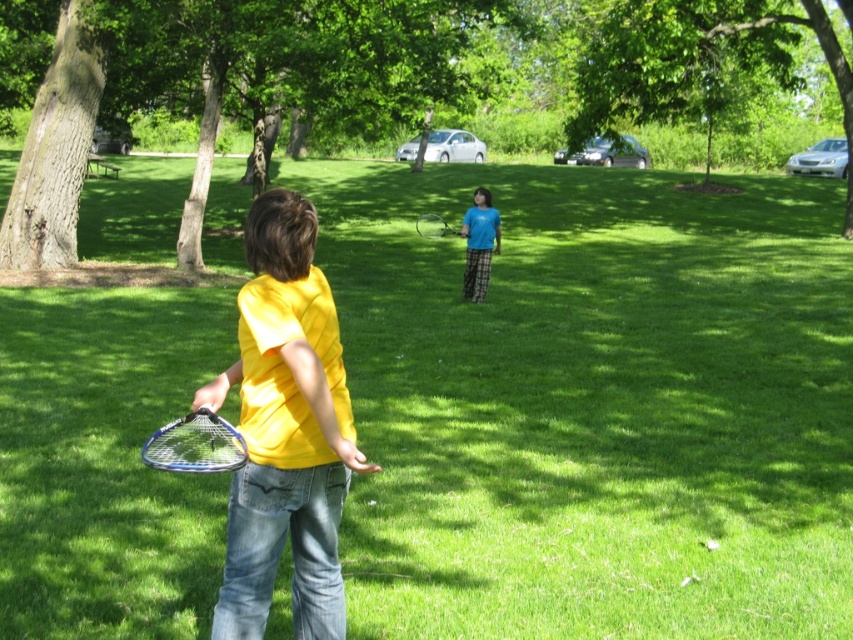
Question: Which of the following is the closest to the observer?

Choices:
 (A) (639, 65)
 (B) (149, 100)
 (C) (270, 273)

Answer: (C)

Question: Which point is farther from the camera taking this photo?

Choices:
 (A) (32, 170)
 (B) (490, 204)
 (C) (573, 113)

Answer: (C)

Question: Which object appears closest to the camera in this image?

Choices:
 (A) yellow matte t-shirt at center
 (B) green leafy tree at upper center
 (C) brown rough bark tree at left

Answer: (A)

Question: Is green leafy tree at upper center smaller than blue metallic tennis racket at lower left?

Choices:
 (A) yes
 (B) no

Answer: (B)

Question: Does blue metallic tennis racket at lower left have a larger size compared to blue metallic tennis racket at center?

Choices:
 (A) no
 (B) yes

Answer: (A)

Question: Is matte blue shirt at center below blue metallic tennis racket at center?

Choices:
 (A) no
 (B) yes

Answer: (B)